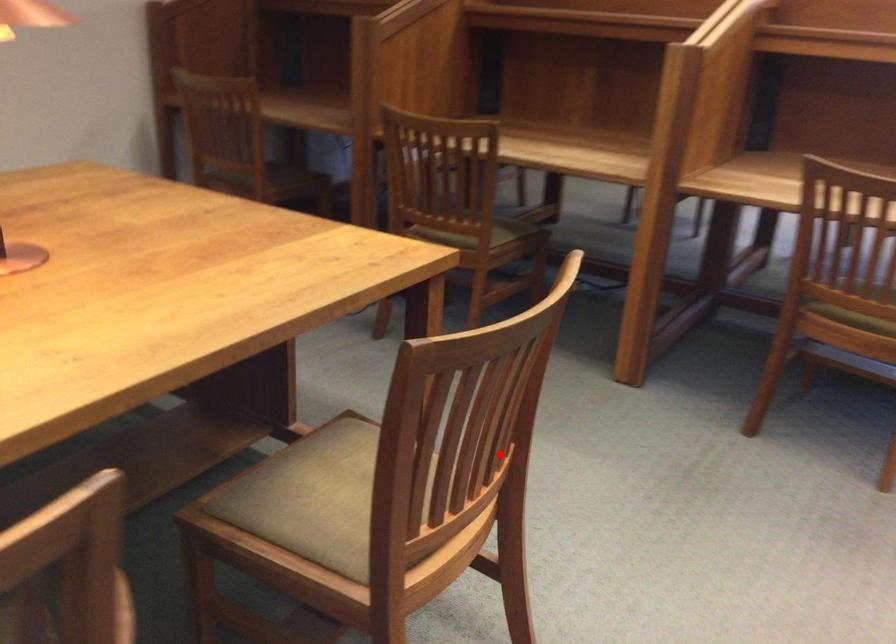
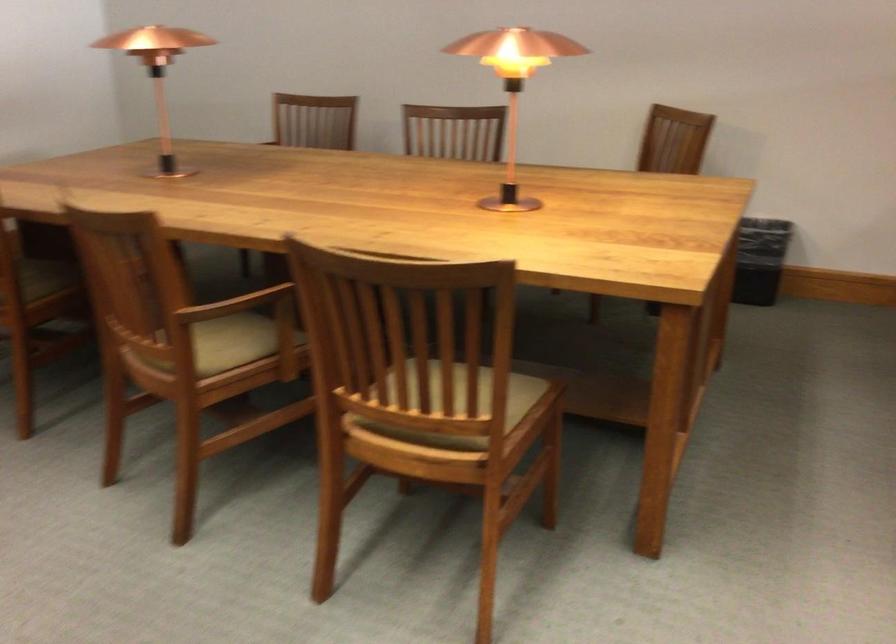
Find the pixel in the second image that matches the highlighted location in the first image.

(460, 404)